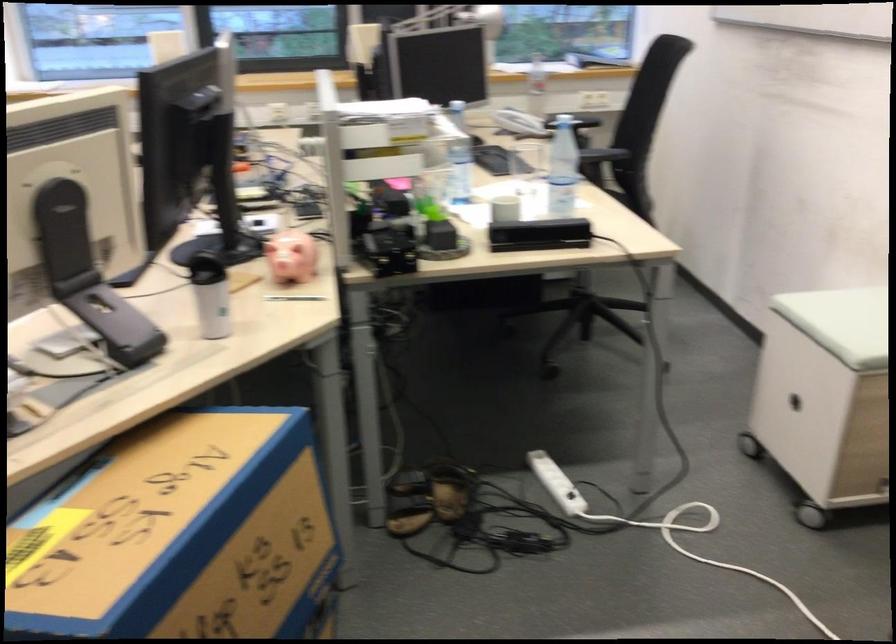
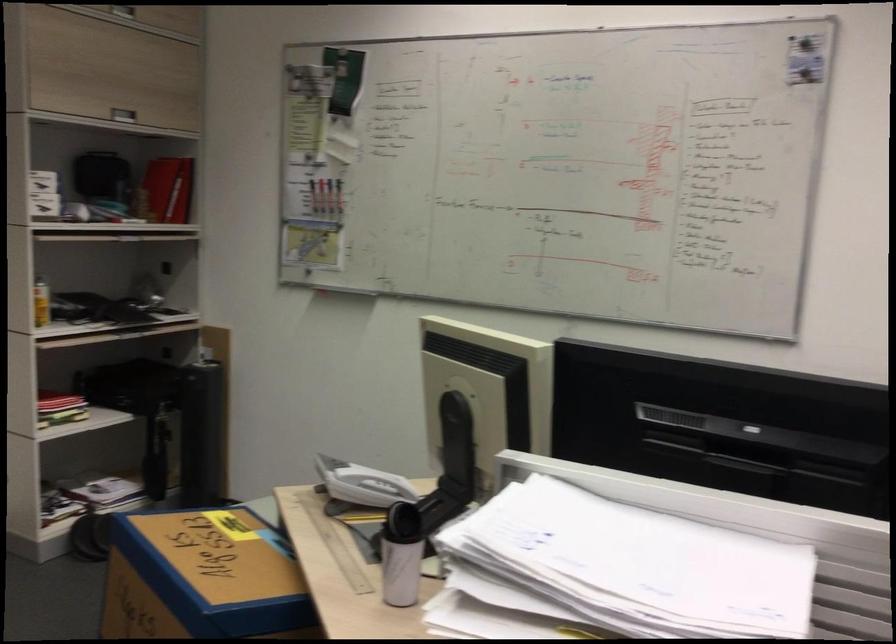
Where in the second image is the point corresponding to pixel 217 469 from the first image?

(202, 578)